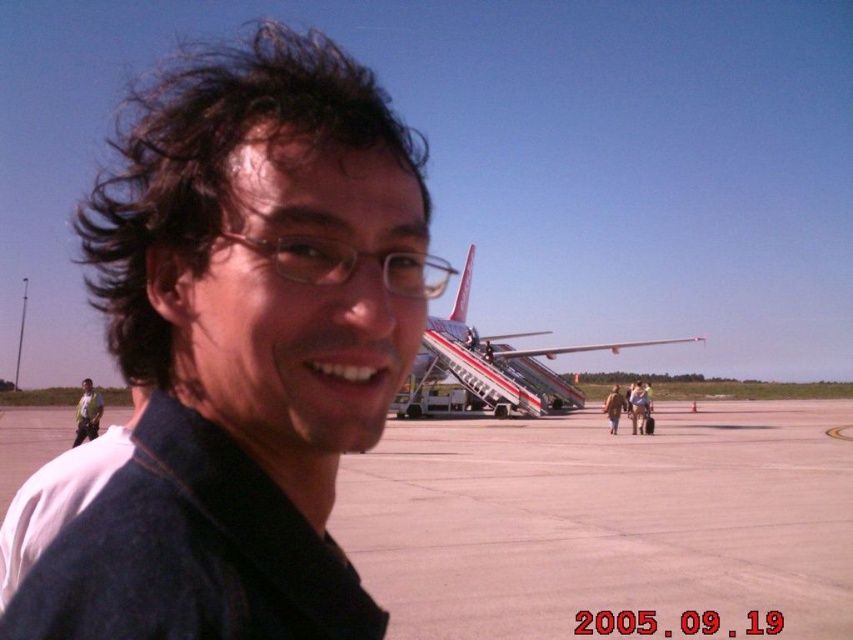
Question: Which point is closer to the camera?

Choices:
 (A) (453, 310)
 (B) (82, 413)

Answer: (B)

Question: Which point appears farthest from the camera in this image?

Choices:
 (A) (293, 72)
 (B) (566, 579)
 (C) (79, 429)

Answer: (C)

Question: Can you confirm if smooth concrete tarmac at center is thinner than matte black shirt at left?

Choices:
 (A) yes
 (B) no

Answer: (B)

Question: From the image, what is the correct spatial relationship of dark blue shirt at center in relation to white painted fuselage at center?

Choices:
 (A) right
 (B) left

Answer: (B)

Question: Which of the following is the farthest from the observer?

Choices:
 (A) (80, 438)
 (B) (503, 392)

Answer: (B)

Question: Does white painted fuselage at center lie behind matte black shirt at left?

Choices:
 (A) no
 (B) yes

Answer: (B)